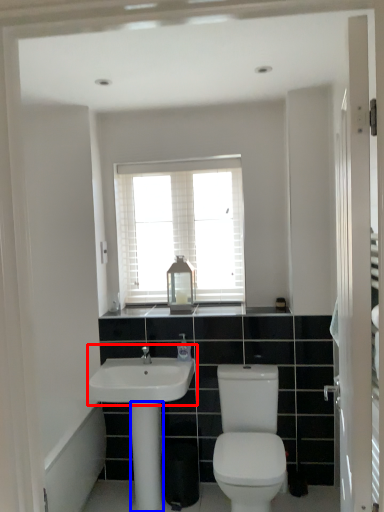
Question: Which object is closer to the camera taking this photo, sink (highlighted by a red box) or pillar (highlighted by a blue box)?

Choices:
 (A) sink
 (B) pillar

Answer: (A)